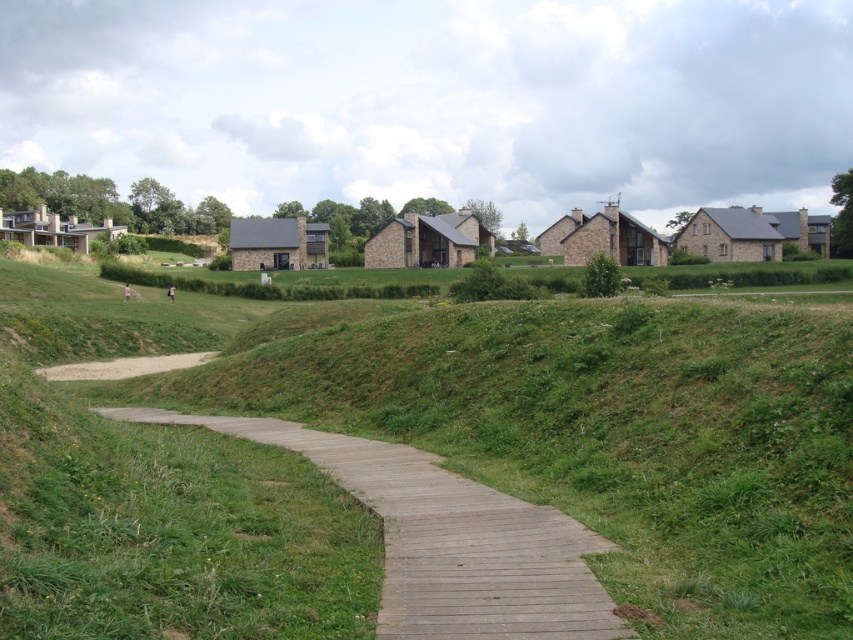
Is point (74, 548) behind point (462, 483)?

That is False.

Can you confirm if green grassy at center is positioned to the right of wooden boardwalk at center?

In fact, green grassy at center is to the left of wooden boardwalk at center.

Which is behind, point (804, 326) or point (483, 548)?

Positioned behind is point (804, 326).

At what (x,y) coordinates should I click in order to perform the action: click on green grassy at center. Please return your answer as a coordinate pair (x, y). Looking at the image, I should click on (425, 448).